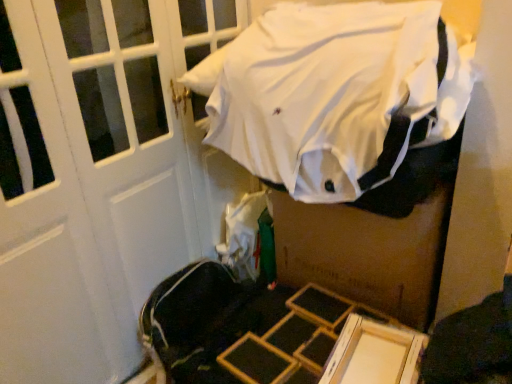
Question: Is brown cardboard box at center located within white fabric shirt at upper center?

Choices:
 (A) no
 (B) yes

Answer: (A)

Question: From a real-world perspective, is white fabric shirt at upper center below brown cardboard box at center?

Choices:
 (A) no
 (B) yes

Answer: (A)

Question: Is white fabric shirt at upper center touching brown cardboard box at center?

Choices:
 (A) no
 (B) yes

Answer: (A)

Question: Can we say white fabric shirt at upper center lies outside brown cardboard box at center?

Choices:
 (A) no
 (B) yes

Answer: (B)

Question: Can you confirm if white fabric shirt at upper center is thinner than brown cardboard box at center?

Choices:
 (A) yes
 (B) no

Answer: (B)

Question: Can you confirm if white fabric shirt at upper center is taller than brown cardboard box at center?

Choices:
 (A) yes
 (B) no

Answer: (B)

Question: From a real-world perspective, is brown cardboard box at center located beneath white fabric shirt at upper center?

Choices:
 (A) no
 (B) yes

Answer: (B)

Question: From a real-world perspective, is brown cardboard box at center on white fabric shirt at upper center?

Choices:
 (A) yes
 (B) no

Answer: (B)

Question: Is brown cardboard box at center thinner than white fabric shirt at upper center?

Choices:
 (A) yes
 (B) no

Answer: (A)

Question: Is brown cardboard box at center touching white fabric shirt at upper center?

Choices:
 (A) no
 (B) yes

Answer: (A)

Question: Is brown cardboard box at center wider than white fabric shirt at upper center?

Choices:
 (A) no
 (B) yes

Answer: (A)

Question: From the image's perspective, does brown cardboard box at center appear lower than white fabric shirt at upper center?

Choices:
 (A) no
 (B) yes

Answer: (B)

Question: Is brown cardboard box at center in front of or behind white fabric shirt at upper center in the image?

Choices:
 (A) front
 (B) behind

Answer: (B)